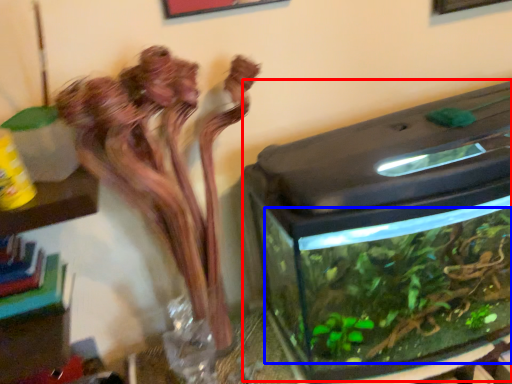
Question: Which object is further to the camera taking this photo, water tank (highlighted by a red box) or plant (highlighted by a blue box)?

Choices:
 (A) water tank
 (B) plant

Answer: (B)